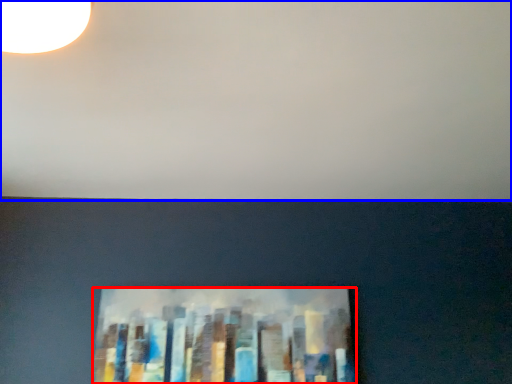
Question: Among these objects, which one is farthest to the camera, picture frame (highlighted by a red box) or backdrop (highlighted by a blue box)?

Choices:
 (A) picture frame
 (B) backdrop

Answer: (A)